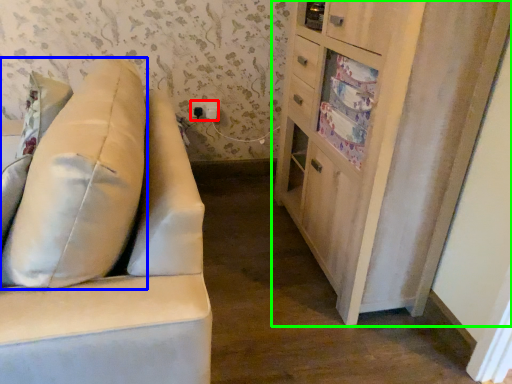
Question: Considering the real-world distances, which object is farthest from electric outlet (highlighted by a red box)? throw pillow (highlighted by a blue box) or cabinetry (highlighted by a green box)?

Choices:
 (A) throw pillow
 (B) cabinetry

Answer: (A)